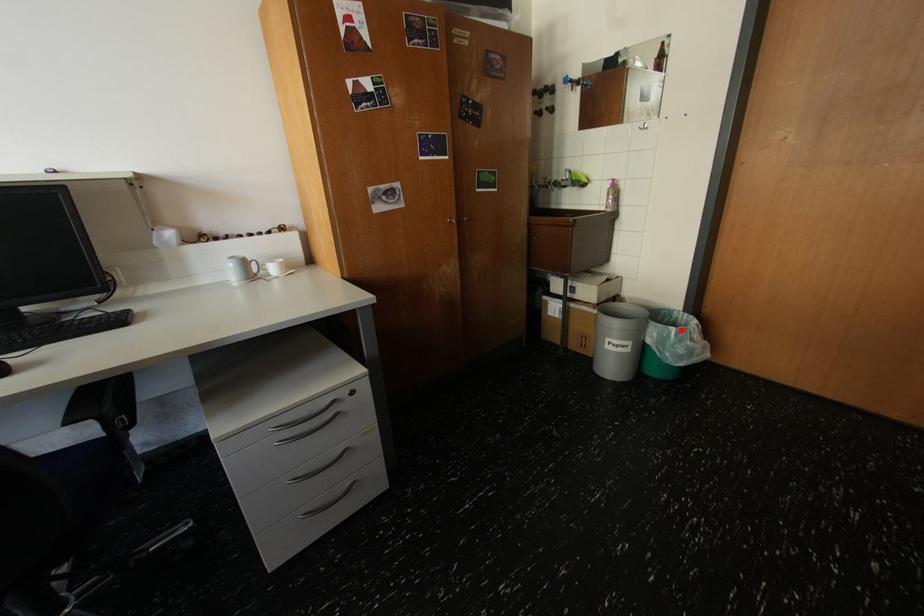
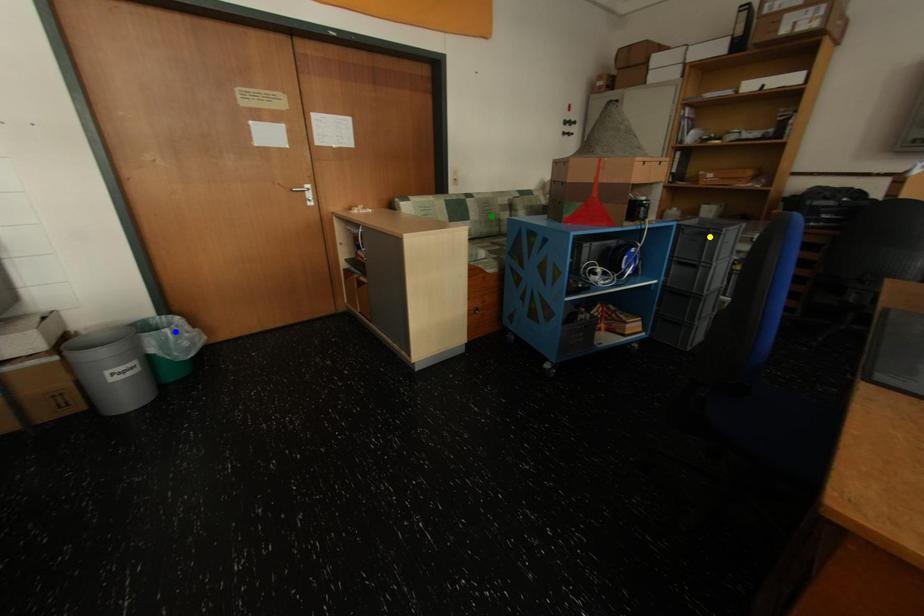
Question: I am providing you with two images of the same scene from different viewpoints. A red point is marked on the first image. You are given multiple points on the second image. In image 2, which mark is for the same physical point as the one in image 1?

Choices:
 (A) blue point
 (B) green point
 (C) yellow point

Answer: (A)